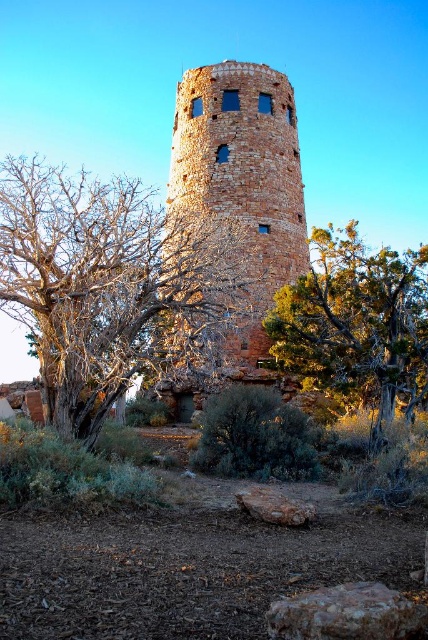
You are an explorer in the desert and see the bare branches at center and the rustic brick tower at center. Which one is taller?

The rustic brick tower at center is taller than the bare branches at center.